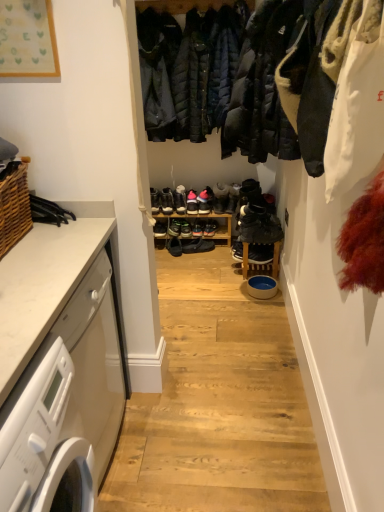
Question: Is point (200, 200) positioned closer to the camera than point (99, 478)?

Choices:
 (A) farther
 (B) closer

Answer: (A)

Question: Considering the positions of pink suede sneakers at center, which is counted as the third footwear, starting from the right, and white marble countertop at left in the image, is pink suede sneakers at center, which is counted as the third footwear, starting from the right, wider or thinner than white marble countertop at left?

Choices:
 (A) thin
 (B) wide

Answer: (A)

Question: Which is nearer to the white glossy washing machine at left?

Choices:
 (A) woven brown basket at left
 (B) pink suede sneakers at center, the 6th footwear viewed from the left
 (C) black leather shoe at center, arranged as the 1th footwear when viewed from the left
 (D) shiny black sneaker at center, the second footwear when ordered from right to left
 (E) black suede shoes at center, which is the 4th footwear from left to right

Answer: (A)

Question: Which object is the closest to the black suede shoes at center, the 1th footwear viewed from the right?

Choices:
 (A) black leather shoe at center, the eighth footwear from the right
 (B) white glossy washing machine at left
 (C) white marble countertop at left
 (D) shiny black sneakers at center, the fourth footwear in the right-to-left sequence
 (E) matte black sneaker at center

Answer: (E)